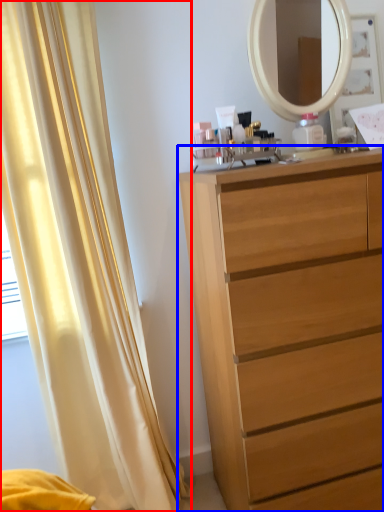
Question: Which object is closer to the camera taking this photo, curtain (highlighted by a red box) or chest of drawers (highlighted by a blue box)?

Choices:
 (A) curtain
 (B) chest of drawers

Answer: (B)